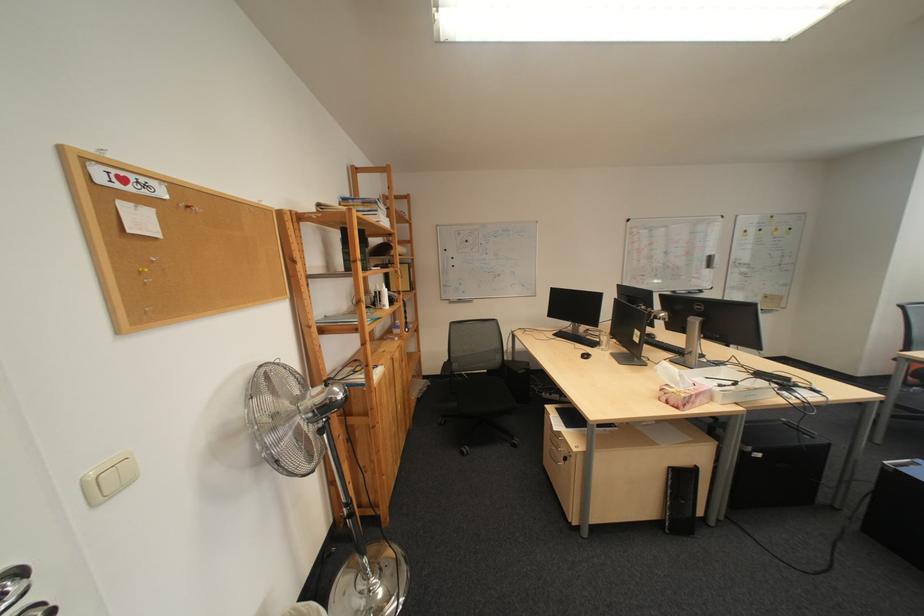
Image resolution: width=924 pixels, height=616 pixels. In order to click on floral tissue box in this screenshot , I will do `click(685, 395)`.